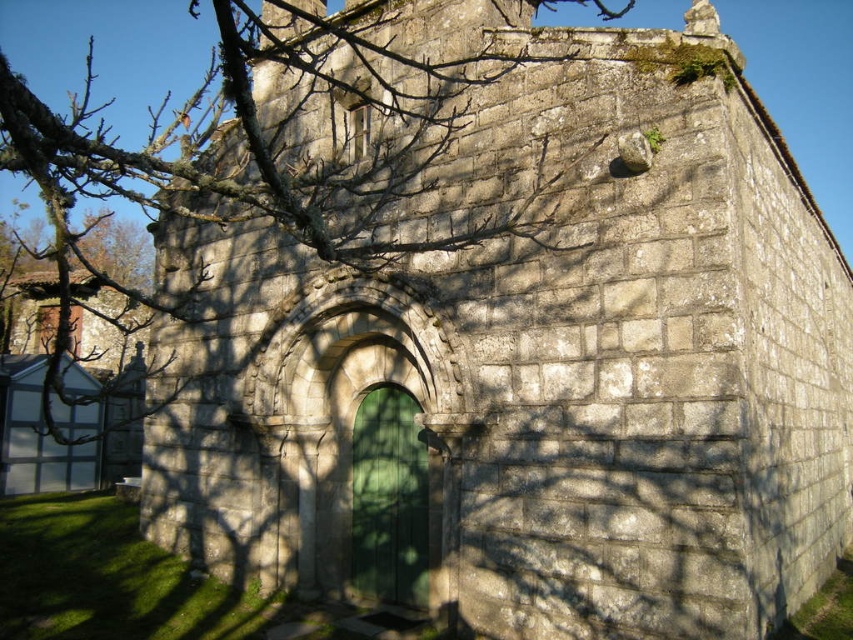
Question: Considering the relative positions of bare branches at upper left and green wooden door at center in the image provided, where is bare branches at upper left located with respect to green wooden door at center?

Choices:
 (A) above
 (B) below

Answer: (A)

Question: Which object is farther from the camera taking this photo?

Choices:
 (A) bare branches at upper left
 (B) green wooden door at center

Answer: (B)

Question: Among these points, which one is farthest from the camera?

Choices:
 (A) (401, 568)
 (B) (282, 225)

Answer: (A)

Question: In this image, where is bare branches at upper left located relative to green wooden door at center?

Choices:
 (A) right
 (B) left

Answer: (B)

Question: Is bare branches at upper left positioned behind green wooden door at center?

Choices:
 (A) no
 (B) yes

Answer: (A)